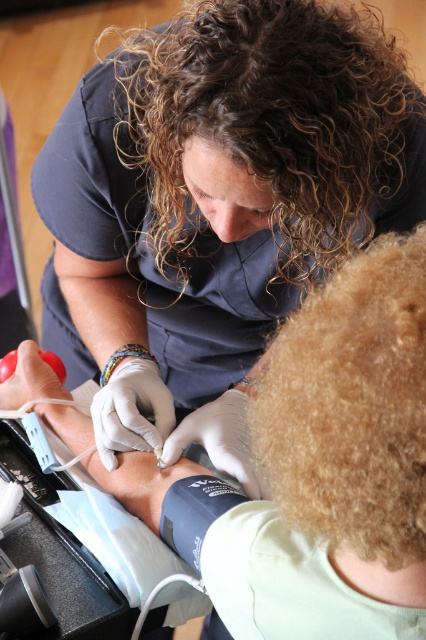
Can you confirm if curly brown hair at upper center is thinner than curly golden hair at lower right?

No.

Find the location of a particular element. The width and height of the screenshot is (426, 640). curly brown hair at upper center is located at coordinates (268, 122).